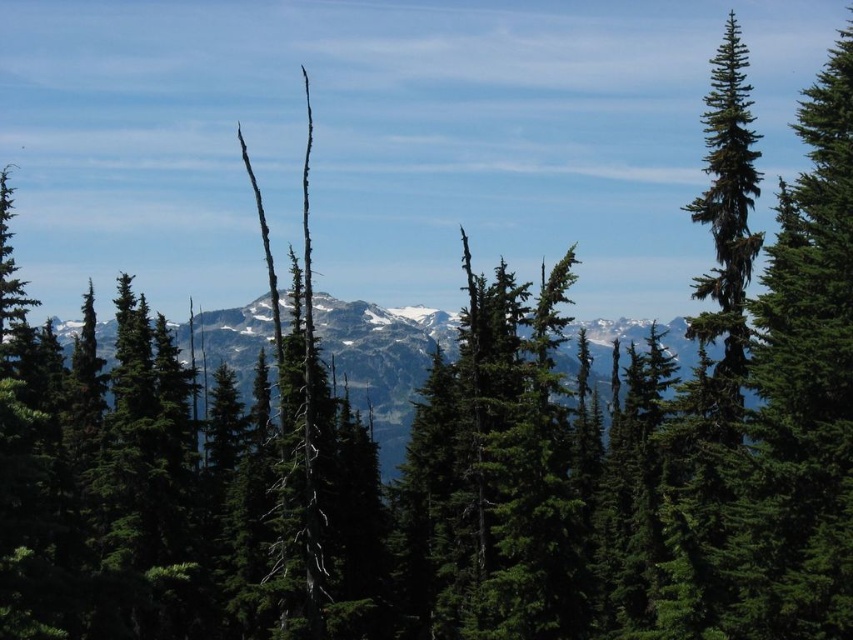
Question: Which point is closer to the camera taking this photo?

Choices:
 (A) (209, 380)
 (B) (570, 468)

Answer: (B)

Question: Which point is farther to the camera?

Choices:
 (A) (534, 500)
 (B) (219, 348)

Answer: (B)

Question: Among these points, which one is farthest from the camera?

Choices:
 (A) tap(369, 320)
 (B) tap(463, 324)

Answer: (A)

Question: Observing the image, what is the correct spatial positioning of green needle-like tree at center in reference to green textured mountain range at center?

Choices:
 (A) below
 (B) above

Answer: (A)

Question: Can you confirm if green needle-like tree at center is thinner than green textured mountain range at center?

Choices:
 (A) no
 (B) yes

Answer: (B)

Question: Is green needle-like tree at center thinner than green textured mountain range at center?

Choices:
 (A) yes
 (B) no

Answer: (A)